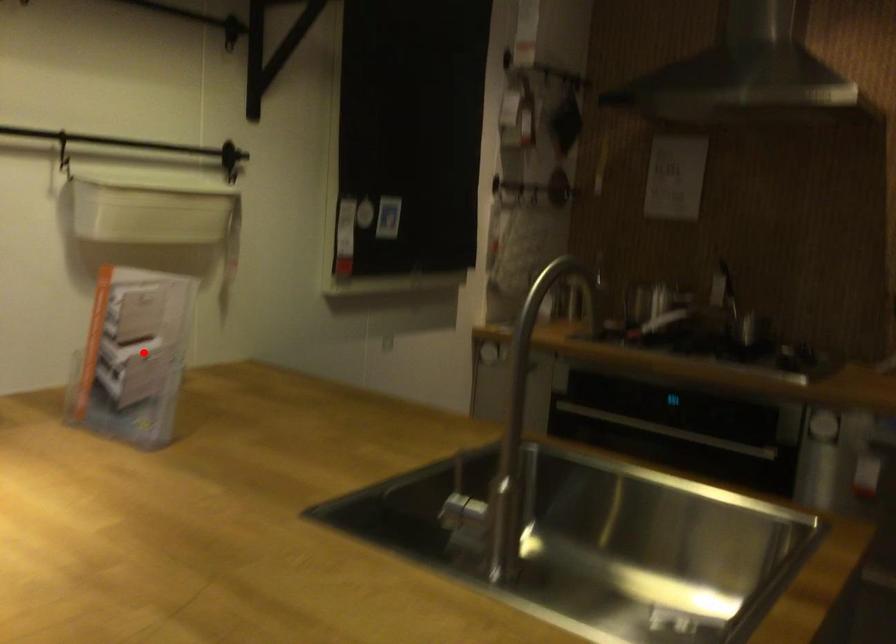
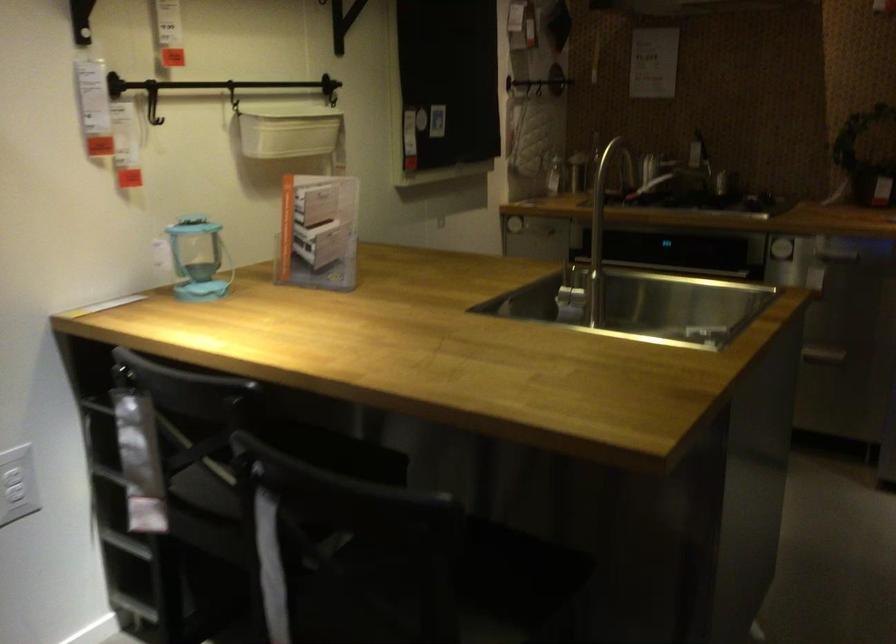
Question: I am providing you with two images of the same scene from different viewpoints. Given a red point in image1, look at the same physical point in image2. Is it:

Choices:
 (A) Closer to the viewpoint
 (B) Farther from the viewpoint

Answer: (B)